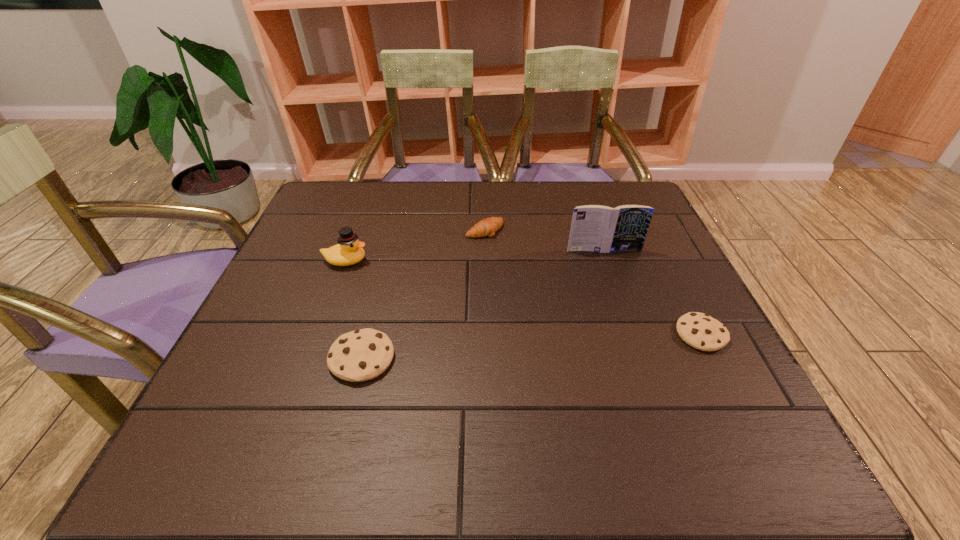
You are a GUI agent. You are given a task and a screenshot of the screen. Output one action in this format:
    pyautogui.click(x=<x>, y=<y>)
    Task: Click on the free space located 0.210m on the left of the farthest object
    The width and height of the screenshot is (960, 540).
    Given the screenshot: What is the action you would take?
    pyautogui.click(x=387, y=230)

Where is `vacant space situated 0.230m on the front-facing side of the duck`? The width and height of the screenshot is (960, 540). vacant space situated 0.230m on the front-facing side of the duck is located at coordinates (463, 261).

What are the coordinates of `object that is positioned at the far edge` in the screenshot? It's located at (487, 227).

What are the coordinates of `object located at the near edge` in the screenshot? It's located at (357, 356).

Where is `object that is at the left edge`? object that is at the left edge is located at coordinates (349, 250).

At what (x,y) coordinates should I click in order to perform the action: click on cookie that is at the right edge. Please return your answer as a coordinate pair (x, y). This screenshot has height=540, width=960. Looking at the image, I should click on (701, 331).

Locate an element on the screen. The height and width of the screenshot is (540, 960). book that is positioned at the right edge is located at coordinates (597, 228).

In the image, there is a desktop. Where is `vacant space at the far edge`? Image resolution: width=960 pixels, height=540 pixels. vacant space at the far edge is located at coordinates (541, 190).

Locate an element on the screen. vacant space at the near edge is located at coordinates (629, 393).

At what (x,y) coordinates should I click in order to perform the action: click on vacant area at the left edge. Please return your answer as a coordinate pair (x, y). The height and width of the screenshot is (540, 960). Looking at the image, I should click on (273, 287).